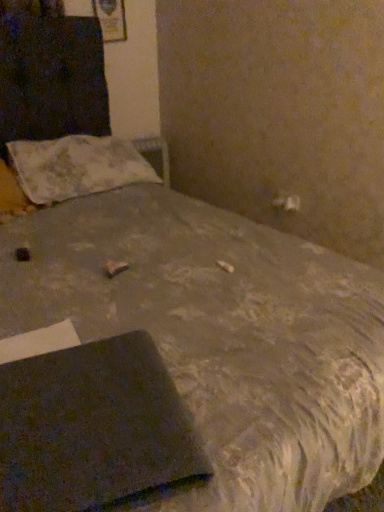
Question: Based on their sizes in the image, would you say fluffy white pillow at upper left is bigger or smaller than dark gray matte notebook at lower left?

Choices:
 (A) small
 (B) big

Answer: (B)

Question: In terms of width, does fluffy white pillow at upper left look wider or thinner when compared to dark gray matte notebook at lower left?

Choices:
 (A) wide
 (B) thin

Answer: (A)

Question: Considering the positions of point (84, 179) and point (104, 390), is point (84, 179) closer or farther from the camera than point (104, 390)?

Choices:
 (A) farther
 (B) closer

Answer: (A)

Question: Is dark gray matte notebook at lower left situated inside fluffy white pillow at upper left or outside?

Choices:
 (A) outside
 (B) inside

Answer: (A)

Question: From a real-world perspective, relative to fluffy white pillow at upper left, is dark gray matte notebook at lower left vertically above or below?

Choices:
 (A) above
 (B) below

Answer: (B)

Question: Is point (135, 362) closer or farther from the camera than point (51, 141)?

Choices:
 (A) closer
 (B) farther

Answer: (A)

Question: In the image, is dark gray matte notebook at lower left positioned in front of or behind fluffy white pillow at upper left?

Choices:
 (A) front
 (B) behind

Answer: (A)